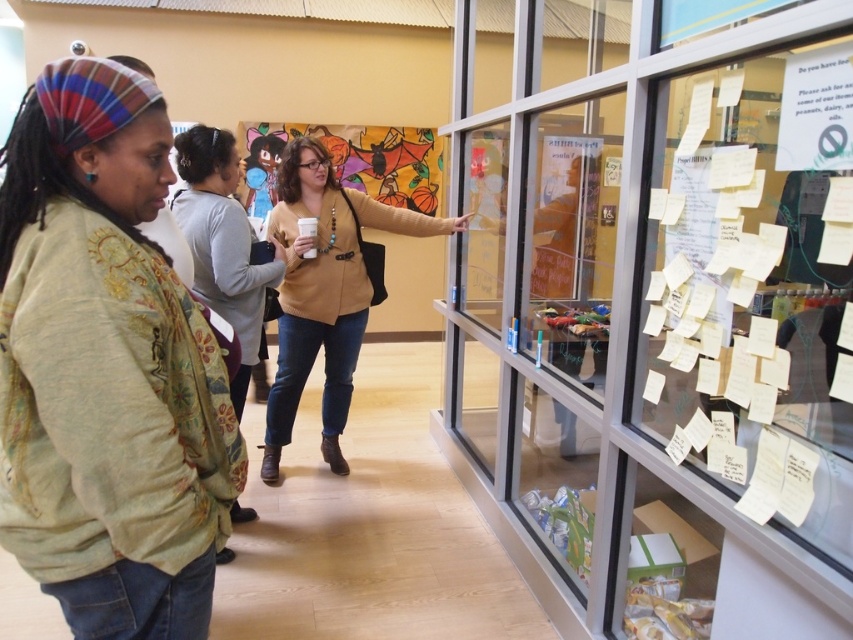
Between point (55, 289) and point (259, 330), which one is positioned in front?

Point (55, 289) is more forward.

The image size is (853, 640). I want to click on floral embroidered jacket at left, so click(106, 369).

Between clear glass window at right and matte brown sweater at center, which one has less height?

With less height is matte brown sweater at center.

Between point (480, 36) and point (368, 280), which one is positioned behind?

Point (480, 36)

Does point (677, 429) come farther from viewer compared to point (312, 173)?

No, (677, 429) is closer to viewer.

I want to click on clear glass window at right, so click(x=659, y=310).

Does clear glass window at right have a smaller size compared to matte beige sweater at center?

Actually, clear glass window at right might be larger than matte beige sweater at center.

Between clear glass window at right and matte beige sweater at center, which one appears on the right side from the viewer's perspective?

From the viewer's perspective, clear glass window at right appears more on the right side.

Describe the element at coordinates (659, 310) in the screenshot. The height and width of the screenshot is (640, 853). I see `clear glass window at right` at that location.

The width and height of the screenshot is (853, 640). Find the location of `clear glass window at right`. clear glass window at right is located at coordinates (659, 310).